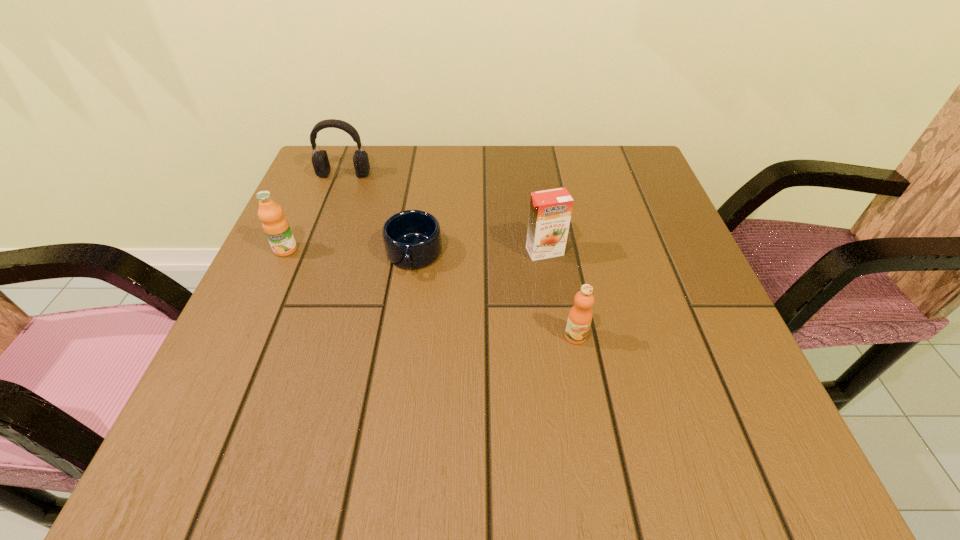
The height and width of the screenshot is (540, 960). I want to click on headset that is positioned at the left edge, so (x=320, y=161).

At what (x,y) coordinates should I click in order to perform the action: click on orange juice located at the left edge. Please return your answer as a coordinate pair (x, y). Looking at the image, I should click on (276, 227).

Image resolution: width=960 pixels, height=540 pixels. I want to click on object situated at the far left corner, so click(320, 161).

In the image, there is a desktop. Find the location of `vacant space at the far edge`. vacant space at the far edge is located at coordinates (536, 147).

Image resolution: width=960 pixels, height=540 pixels. In order to click on vacant space at the near edge of the desktop in this screenshot , I will do `click(475, 439)`.

Locate an element on the screen. free space at the left edge is located at coordinates (227, 357).

Locate an element on the screen. Image resolution: width=960 pixels, height=540 pixels. vacant space at the right edge of the desktop is located at coordinates (677, 269).

You are a GUI agent. You are given a task and a screenshot of the screen. Output one action in this format:
    pyautogui.click(x=<x>, y=<y>)
    Task: Click on the vacant area at the far right corner of the desktop
    
    Given the screenshot: What is the action you would take?
    pyautogui.click(x=658, y=191)

In the image, there is a desktop. Where is `vacant space at the near right corner`? The height and width of the screenshot is (540, 960). vacant space at the near right corner is located at coordinates (771, 472).

In order to click on free spot between the farthest object and the third object from right to left in this screenshot , I will do `click(379, 215)`.